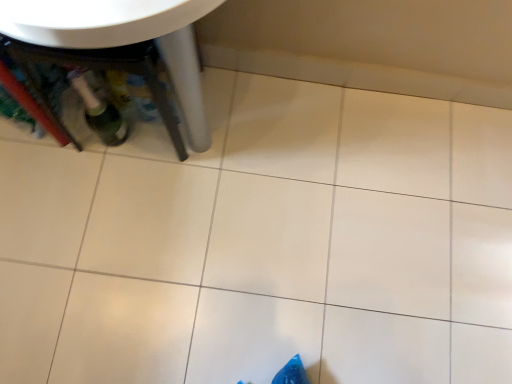
What do you see at coordinates (121, 45) in the screenshot?
I see `white glossy sink at upper left` at bounding box center [121, 45].

The image size is (512, 384). In order to click on white glossy sink at upper left in this screenshot , I will do pyautogui.click(x=121, y=45).

This screenshot has height=384, width=512. What are the coordinates of `white glossy sink at upper left` in the screenshot? It's located at (121, 45).